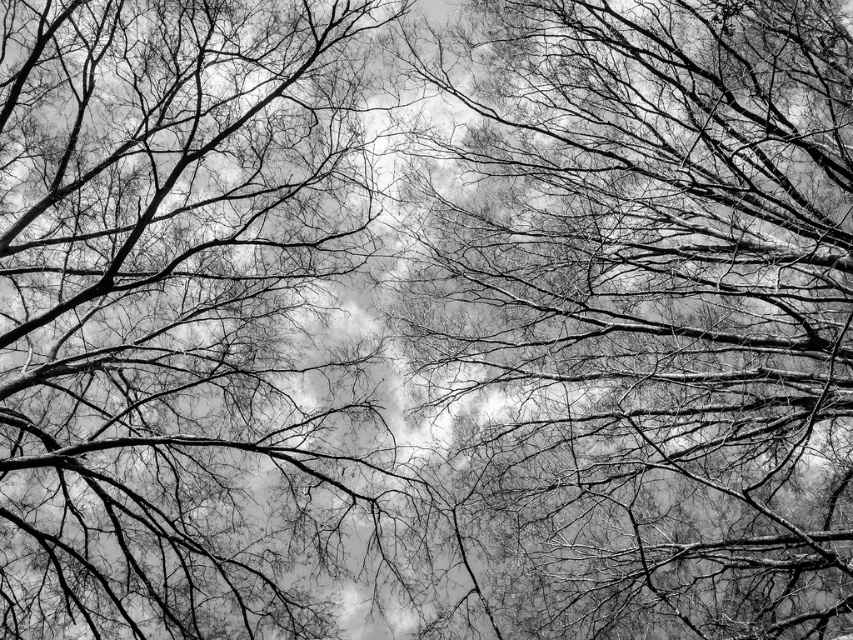
Between point (694, 609) and point (223, 397), which one is positioned in front?

Point (694, 609) is in front.

Is smooth bark tree at center above silhouette branches at center?

Yes, smooth bark tree at center is above silhouette branches at center.

Is point (828, 124) positioned in front of point (148, 461)?

No, it is behind (148, 461).

Locate an element on the screen. Image resolution: width=853 pixels, height=640 pixels. smooth bark tree at center is located at coordinates (662, 292).